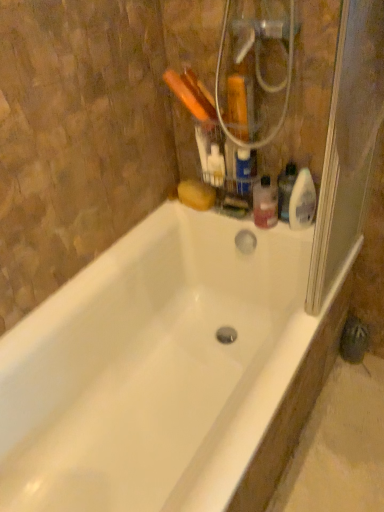
Question: Does white plastic toothbrushes at upper center, the third cleaning product when ordered from right to left, have a greater height compared to translucent plastic spray bottle at upper right, the 3th cleaning product in the left-to-right sequence?

Choices:
 (A) yes
 (B) no

Answer: (B)

Question: Is white plastic toothbrushes at upper center, the third cleaning product when ordered from right to left, to the right of translucent plastic spray bottle at upper right, the 3th cleaning product in the left-to-right sequence, from the viewer's perspective?

Choices:
 (A) no
 (B) yes

Answer: (A)

Question: Considering the relative sizes of white plastic toothbrushes at upper center, the 1th cleaning product in the left-to-right sequence, and translucent plastic spray bottle at upper right, the 1th cleaning product positioned from the right, in the image provided, is white plastic toothbrushes at upper center, the 1th cleaning product in the left-to-right sequence, bigger than translucent plastic spray bottle at upper right, the 1th cleaning product positioned from the right,?

Choices:
 (A) yes
 (B) no

Answer: (B)

Question: From the image's perspective, is white plastic toothbrushes at upper center, the third cleaning product when ordered from right to left, over translucent plastic spray bottle at upper right, the 1th cleaning product positioned from the right?

Choices:
 (A) no
 (B) yes

Answer: (B)

Question: Is white plastic toothbrushes at upper center, the 1th cleaning product in the left-to-right sequence, shorter than translucent plastic spray bottle at upper right, the 1th cleaning product positioned from the right?

Choices:
 (A) no
 (B) yes

Answer: (B)

Question: Can you confirm if white plastic toothbrushes at upper center, the third cleaning product when ordered from right to left, is positioned to the left of translucent plastic spray bottle at upper right, the 3th cleaning product in the left-to-right sequence?

Choices:
 (A) yes
 (B) no

Answer: (A)

Question: Is translucent plastic bottle at upper right, the second cleaning product from the right, directly adjacent to transparent plastic screen door at right?

Choices:
 (A) no
 (B) yes

Answer: (A)

Question: Is translucent plastic bottle at upper right, the second cleaning product from the right, wider than transparent plastic screen door at right?

Choices:
 (A) no
 (B) yes

Answer: (B)

Question: Is translucent plastic bottle at upper right, arranged as the second cleaning product when viewed from the left, to the right of transparent plastic screen door at right from the viewer's perspective?

Choices:
 (A) no
 (B) yes

Answer: (A)

Question: Can you confirm if translucent plastic bottle at upper right, the second cleaning product from the right, is bigger than transparent plastic screen door at right?

Choices:
 (A) yes
 (B) no

Answer: (B)

Question: Does translucent plastic bottle at upper right, arranged as the second cleaning product when viewed from the left, lie behind transparent plastic screen door at right?

Choices:
 (A) yes
 (B) no

Answer: (A)

Question: Considering the relative sizes of translucent plastic bottle at upper right, arranged as the second cleaning product when viewed from the left, and transparent plastic screen door at right in the image provided, is translucent plastic bottle at upper right, arranged as the second cleaning product when viewed from the left, smaller than transparent plastic screen door at right?

Choices:
 (A) yes
 (B) no

Answer: (A)

Question: Can you confirm if translucent plastic bottle at upper right, the second cleaning product from the right, is wider than translucent plastic bottle at upper right?

Choices:
 (A) no
 (B) yes

Answer: (A)